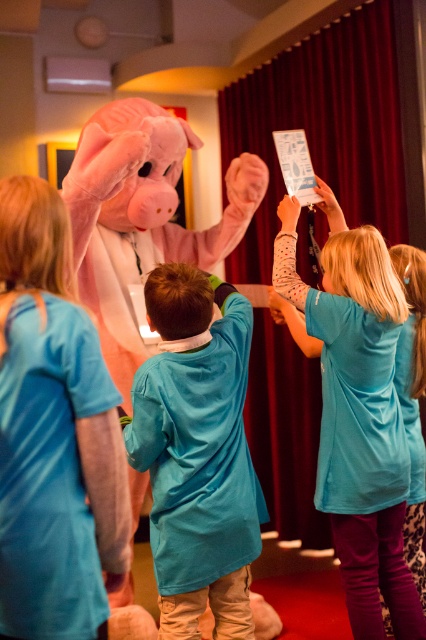
You are a stage designer who needs to adjust the placement of the velvet red curtain at upper center and the blue fabric dress at center. If the stage requires that these two items must be at least 6 feet apart for safety reasons, is their current distance sufficient?

The velvet red curtain at upper center is currently 5.58 feet away from the blue fabric dress at center, which is less than the required 6 feet. Therefore, the current distance is insufficient and adjustments are needed to meet safety standards.